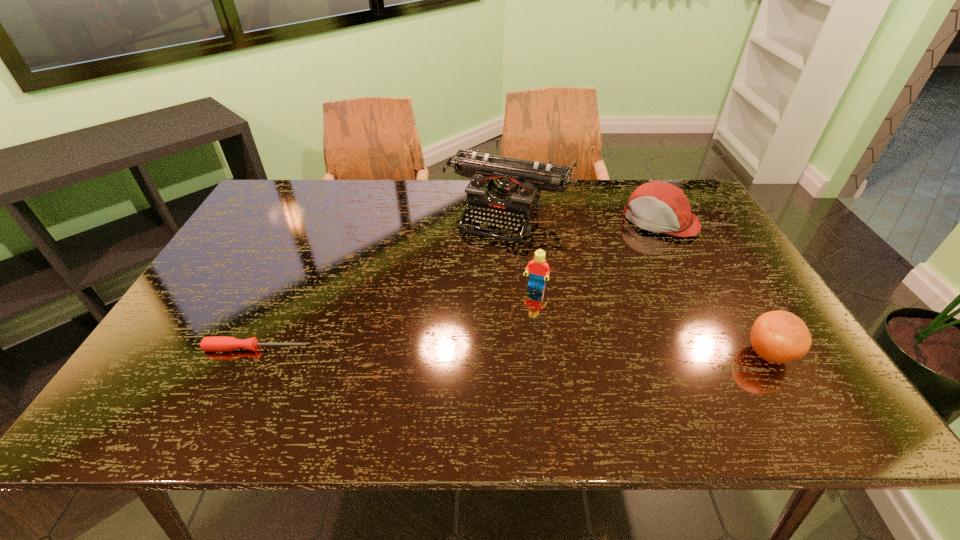
Where is `the shortest object`? the shortest object is located at coordinates (217, 343).

Locate an element on the screen. The image size is (960, 540). screwdriver is located at coordinates (217, 343).

At what (x,y) coordinates should I click in order to perform the action: click on orange. Please return your answer as a coordinate pair (x, y). The width and height of the screenshot is (960, 540). Looking at the image, I should click on (778, 337).

At what (x,y) coordinates should I click in order to perform the action: click on typewriter. Please return your answer as a coordinate pair (x, y). The height and width of the screenshot is (540, 960). Looking at the image, I should click on (504, 189).

Find the location of a particular element. The width and height of the screenshot is (960, 540). cap is located at coordinates (660, 207).

At what (x,y) coordinates should I click in order to perform the action: click on the third nearest object. Please return your answer as a coordinate pair (x, y). Image resolution: width=960 pixels, height=540 pixels. Looking at the image, I should click on (539, 269).

The image size is (960, 540). Identify the location of vacant space located at the tip of the shortest object. (413, 348).

Where is `free location located 0.250m on the left of the orange`? This screenshot has height=540, width=960. free location located 0.250m on the left of the orange is located at coordinates [x=634, y=354].

Where is `vacant space located on the keyboard of the tallest object`? The width and height of the screenshot is (960, 540). vacant space located on the keyboard of the tallest object is located at coordinates (469, 287).

This screenshot has width=960, height=540. Identify the location of vacant area located 0.150m on the keyboard of the tallest object. (474, 277).